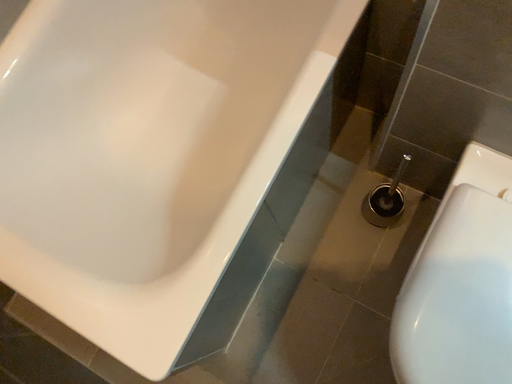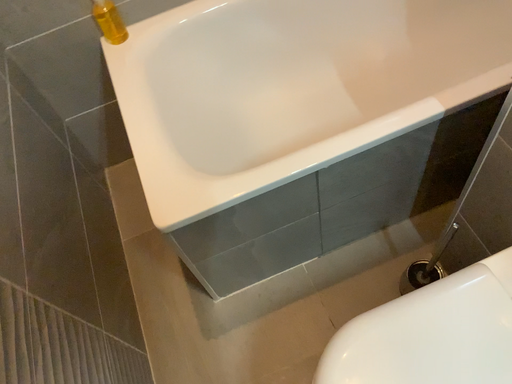
Question: Which way did the camera rotate in the video?

Choices:
 (A) rotated right
 (B) rotated left

Answer: (B)